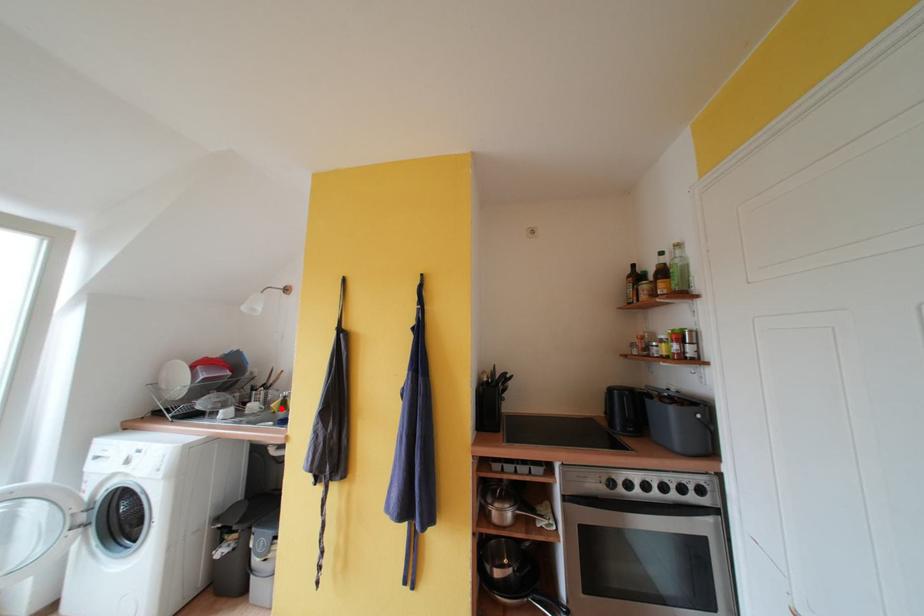
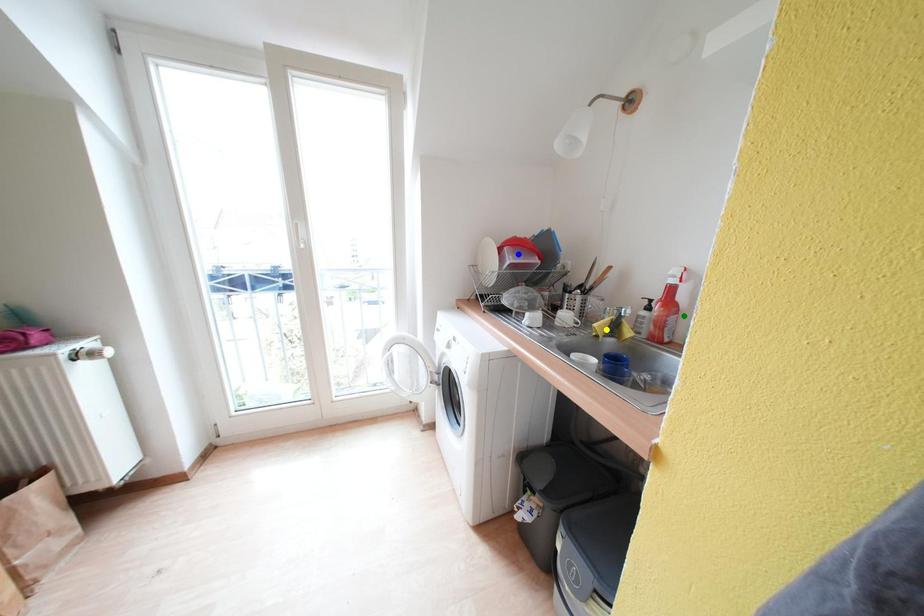
Question: I am providing you with two images of the same scene from different viewpoints. A red point is marked on the first image. You are given multiple points on the second image. In image 2, which mark is for the same physical point as the one in image 1?

Choices:
 (A) green point
 (B) blue point
 (C) yellow point

Answer: (C)